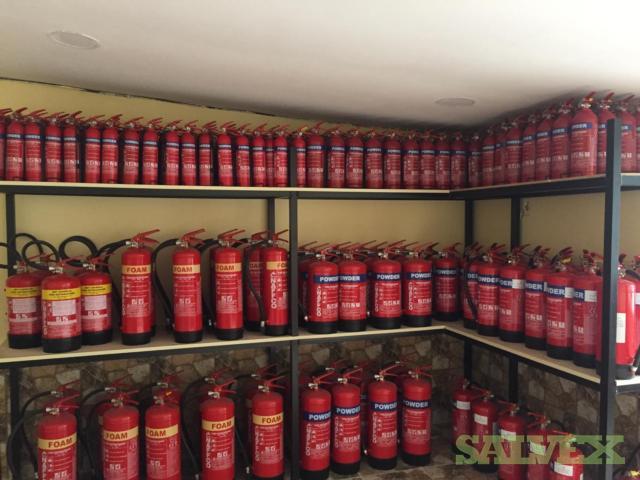
Where is `gray color of shelf`? The height and width of the screenshot is (480, 640). gray color of shelf is located at coordinates (173, 345), (400, 327), (521, 352).